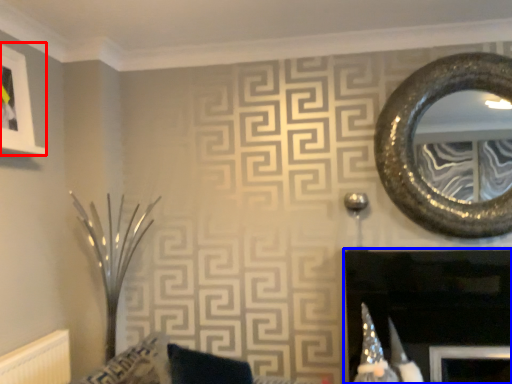
Question: Which of the following is the closest to the observer, picture frame (highlighted by a red box) or fireplace (highlighted by a blue box)?

Choices:
 (A) picture frame
 (B) fireplace

Answer: (B)